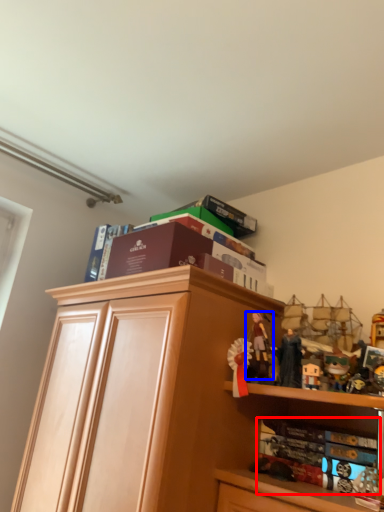
Question: Which point is further to the camera, book (highlighted by a red box) or person (highlighted by a blue box)?

Choices:
 (A) book
 (B) person

Answer: (B)